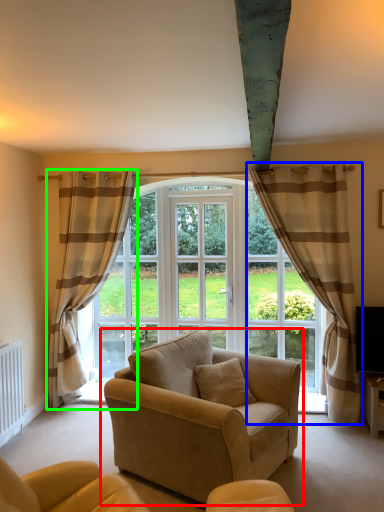
Question: Which is nearer to the studio couch (highlighted by a red box)? curtain (highlighted by a blue box) or curtain (highlighted by a green box).

Choices:
 (A) curtain
 (B) curtain

Answer: (A)